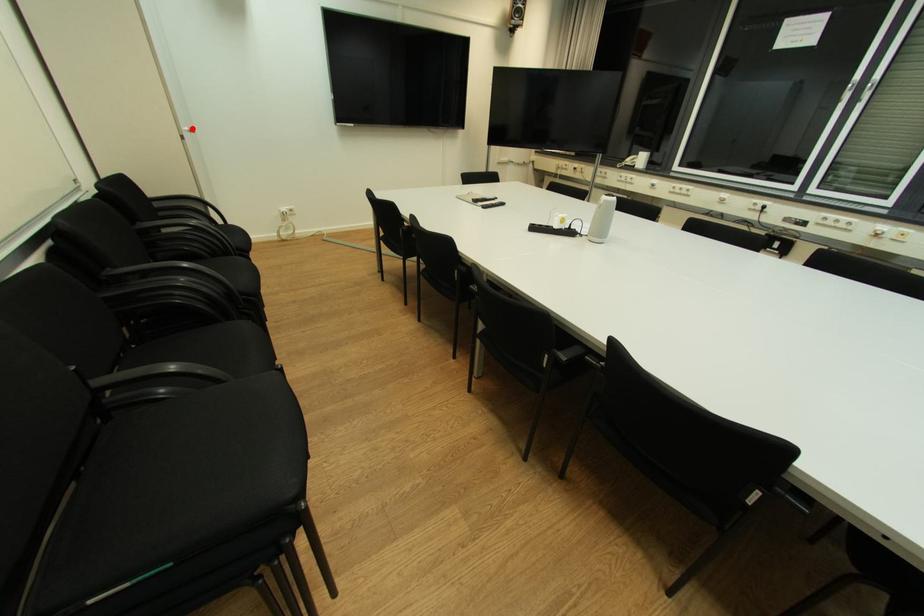
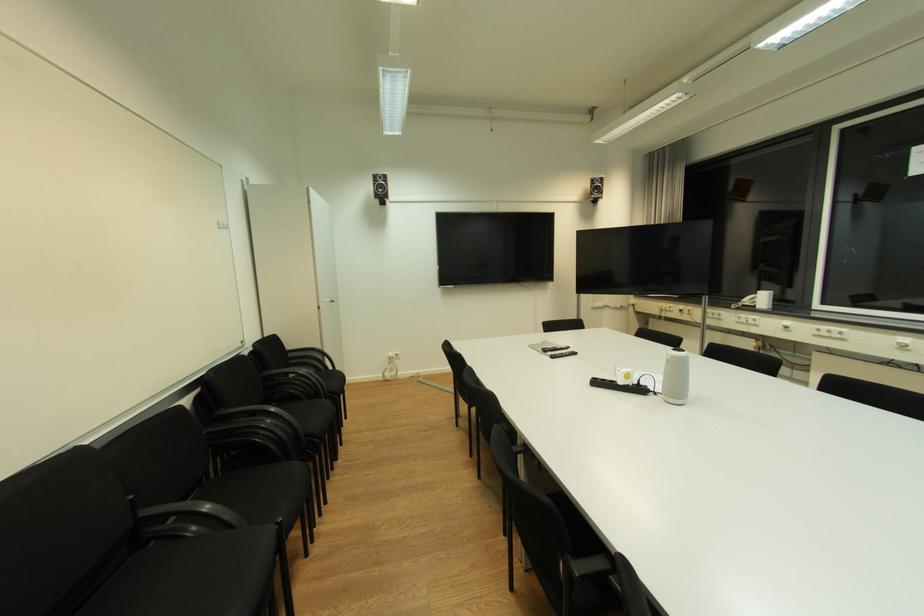
In the second image, find the point that corresponds to the highlighted location in the first image.

(334, 301)